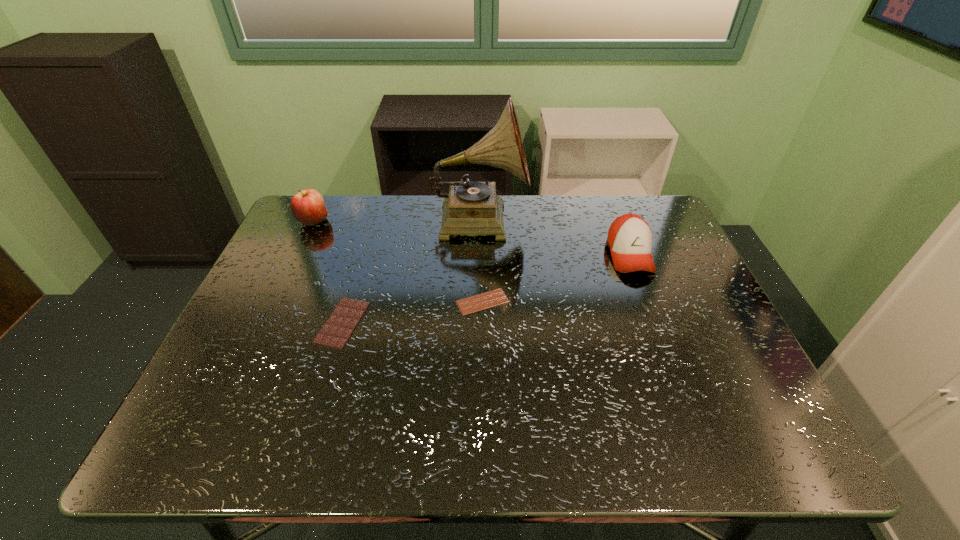
Locate an element on the screen. This screenshot has width=960, height=540. free space located on the right of the left chocolate bar is located at coordinates (506, 322).

Locate an element on the screen. The image size is (960, 540). vacant point located on the front of the right chocolate bar is located at coordinates (483, 389).

Identify the location of record player situated at the far edge. (471, 208).

I want to click on apple at the far edge, so click(x=307, y=206).

Identify the location of baseball cap that is at the far edge. Image resolution: width=960 pixels, height=540 pixels. (629, 239).

You are a GUI agent. You are given a task and a screenshot of the screen. Output one action in this format:
    pyautogui.click(x=<x>, y=<y>)
    Task: Click on the object at the left edge
    The height and width of the screenshot is (540, 960).
    Given the screenshot: What is the action you would take?
    pyautogui.click(x=307, y=206)

Find the location of a particular element. This screenshot has height=540, width=960. object located at the right edge is located at coordinates (629, 239).

You are a GUI agent. You are given a task and a screenshot of the screen. Output one action in this format:
    pyautogui.click(x=<x>, y=<y>)
    Task: Click on the object that is at the far left corner
    The width and height of the screenshot is (960, 540).
    Given the screenshot: What is the action you would take?
    pyautogui.click(x=307, y=206)

Identify the location of object that is positioned at the far right corner. Image resolution: width=960 pixels, height=540 pixels. (629, 239).

At what (x,y) coordinates should I click in order to perform the action: click on vacant space at the far edge of the desktop. Please return your answer as a coordinate pair (x, y). The height and width of the screenshot is (540, 960). Looking at the image, I should click on (430, 220).